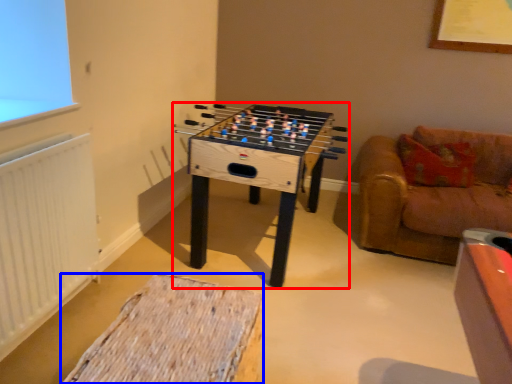
Question: Which of the following is the closest to the observer, table (highlighted by a red box) or furniture (highlighted by a blue box)?

Choices:
 (A) table
 (B) furniture

Answer: (B)